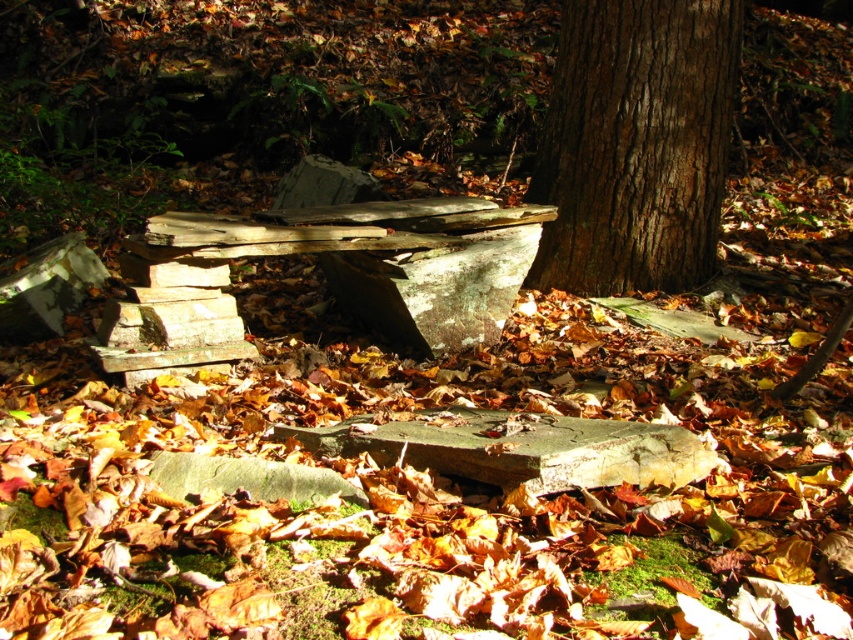
You are a hiker trying to determine which object at the center of the forest scene is bigger. The scene has a brown rough bark tree at center and a green weathered stone at center. Can you tell me which one is bigger?

The brown rough bark tree at center is larger in size than the green weathered stone at center, so the brown rough bark tree at center is bigger.

You are standing in the autumn forest scene. There are two points marked on the ground. One is at coordinates point (682, 240) and the other at point (260, 467). From your perspective, which point is closer to you?

Point (260, 467) is closer to you because point (682, 240) is behind it.